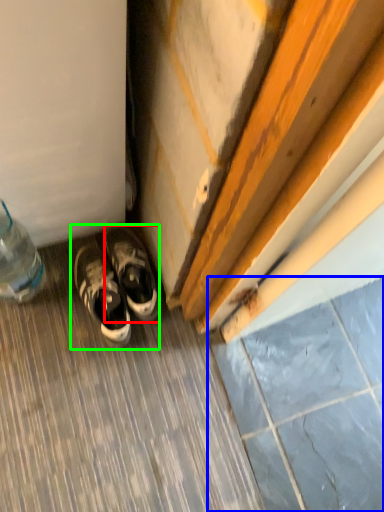
Question: Considering the real-world distances, which object is closest to sneakers (highlighted by a red box)? tile (highlighted by a blue box) or footwear (highlighted by a green box).

Choices:
 (A) tile
 (B) footwear

Answer: (B)